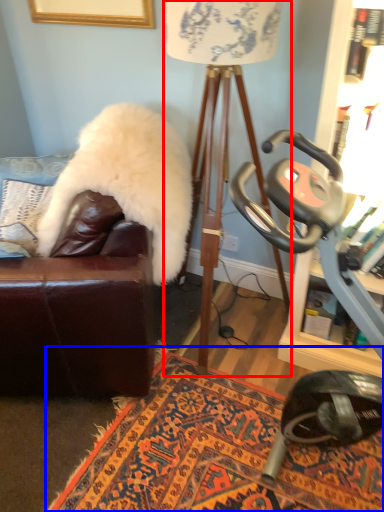
Question: Which object is closer to the camera taking this photo, table lamp (highlighted by a red box) or mat (highlighted by a blue box)?

Choices:
 (A) table lamp
 (B) mat

Answer: (A)